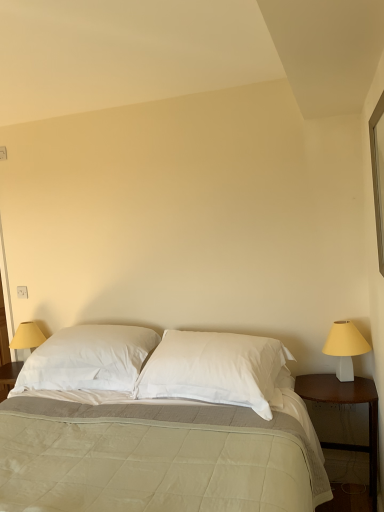
Question: Is the position of clear glass window at upper right less distant than that of white matte lampshade at right?

Choices:
 (A) yes
 (B) no

Answer: (A)

Question: Is clear glass window at upper right positioned behind white matte lampshade at right?

Choices:
 (A) yes
 (B) no

Answer: (B)

Question: Is clear glass window at upper right smaller than white matte lampshade at right?

Choices:
 (A) yes
 (B) no

Answer: (A)

Question: Is clear glass window at upper right at the right side of white matte lampshade at right?

Choices:
 (A) yes
 (B) no

Answer: (B)

Question: From the image's perspective, is clear glass window at upper right under white matte lampshade at right?

Choices:
 (A) no
 (B) yes

Answer: (A)

Question: Visually, is wooden nightstand at right positioned to the left or to the right of white soft pillow at center, which is the 2th pillow from right to left?

Choices:
 (A) left
 (B) right

Answer: (B)

Question: From a real-world perspective, relative to white soft pillow at center, which is the first pillow in left-to-right order, is wooden nightstand at right vertically above or below?

Choices:
 (A) above
 (B) below

Answer: (B)

Question: Relative to white soft pillow at center, which is the first pillow in left-to-right order, is wooden nightstand at right in front or behind?

Choices:
 (A) behind
 (B) front

Answer: (B)

Question: Looking at the image, does wooden nightstand at right seem bigger or smaller compared to white soft pillow at center, which is the 2th pillow from right to left?

Choices:
 (A) big
 (B) small

Answer: (B)

Question: From a real-world perspective, relative to white matte lampshade at right, is white quilted fabric bed at center vertically above or below?

Choices:
 (A) below
 (B) above

Answer: (A)

Question: From the image's perspective, is white quilted fabric bed at center located above or below white matte lampshade at right?

Choices:
 (A) below
 (B) above

Answer: (A)

Question: Is white quilted fabric bed at center inside the boundaries of white matte lampshade at right, or outside?

Choices:
 (A) outside
 (B) inside

Answer: (A)

Question: Considering the positions of point (125, 401) and point (337, 362), is point (125, 401) closer or farther from the camera than point (337, 362)?

Choices:
 (A) farther
 (B) closer

Answer: (B)

Question: From a real-world perspective, relative to white quilted fabric bed at center, is white soft pillow at center, which is the 2th pillow from right to left, vertically above or below?

Choices:
 (A) above
 (B) below

Answer: (A)

Question: In the image, is white soft pillow at center, which is the 2th pillow from right to left, positioned in front of or behind white quilted fabric bed at center?

Choices:
 (A) front
 (B) behind

Answer: (B)